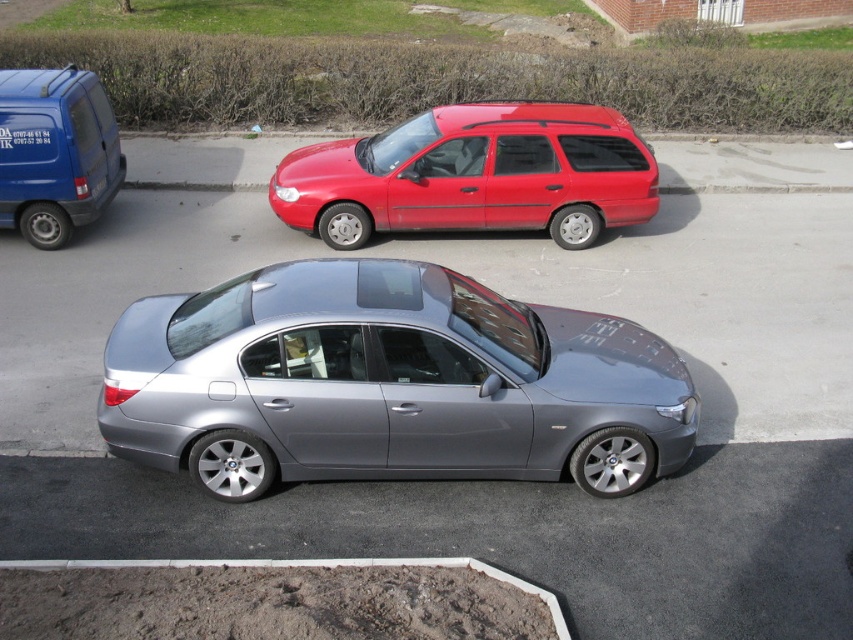
You are standing at the intersection and see a satin metallic sedan at center. Can you determine if the point at coordinates (x=387, y=384) corresponds to the location of the satin metallic sedan at center?

The satin metallic sedan at center is represented by point (x=387, y=384), so yes, the point at coordinates (x=387, y=384) corresponds to the location of the satin metallic sedan at center.

You are a delivery person with a package that needs to be placed between the shiny red station wagon at center and the black plastic license plate at center. The package requires 4 meters of space to fit. Will there be enough space?

The shiny red station wagon at center and black plastic license plate at center are 4.28 meters apart from each other. Since the required space is 4 meters, there is enough space to fit the package between them.